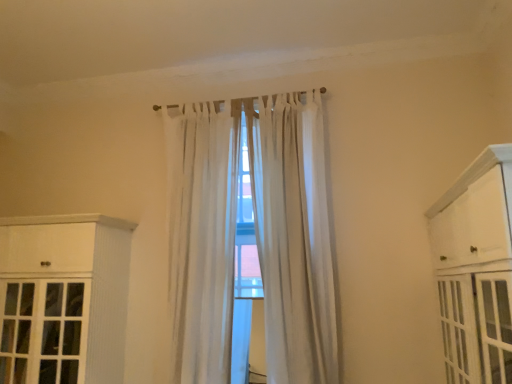
This screenshot has height=384, width=512. Describe the element at coordinates (256, 235) in the screenshot. I see `white sheer curtain at center, placed as the second curtain when sorted from left to right` at that location.

Find the location of a particular element. This screenshot has height=384, width=512. white wood cabinet at left, which is counted as the 2th cabinetry, starting from the front is located at coordinates (63, 298).

What do you see at coordinates (476, 270) in the screenshot? I see `white painted wood cabinet at right, which is the first cabinetry in front-to-back order` at bounding box center [476, 270].

This screenshot has height=384, width=512. Identify the location of white sheer curtain at center, placed as the second curtain when sorted from left to right. (256, 235).

Can you confirm if white sheer curtain at center, placed as the first curtain when sorted from right to left, is shorter than white painted wood cabinet at right, positioned as the second cabinetry in left-to-right order?

In fact, white sheer curtain at center, placed as the first curtain when sorted from right to left, may be taller than white painted wood cabinet at right, positioned as the second cabinetry in left-to-right order.

Choose the correct answer: Is white sheer curtain at center, placed as the second curtain when sorted from left to right, inside white painted wood cabinet at right, positioned as the second cabinetry in left-to-right order, or outside it?

white sheer curtain at center, placed as the second curtain when sorted from left to right, is not enclosed by white painted wood cabinet at right, positioned as the second cabinetry in left-to-right order.

Consider the image. Is white sheer curtain at center, placed as the first curtain when sorted from right to left, turned away from white painted wood cabinet at right, positioned as the second cabinetry in left-to-right order?

No, white sheer curtain at center, placed as the first curtain when sorted from right to left,'s orientation is not away from white painted wood cabinet at right, positioned as the second cabinetry in left-to-right order.

Does point (443, 275) come behind point (298, 360)?

No, it is in front of (298, 360).

Where is `the 2nd curtain above the white painted wood cabinet at right, positioned as the 1th cabinetry in right-to-left order (from the image's perspective)`? the 2nd curtain above the white painted wood cabinet at right, positioned as the 1th cabinetry in right-to-left order (from the image's perspective) is located at coordinates (256, 235).

How much distance is there between white painted wood cabinet at right, positioned as the 1th cabinetry in right-to-left order, and white sheer curtain at center, placed as the second curtain when sorted from left to right?

white painted wood cabinet at right, positioned as the 1th cabinetry in right-to-left order, is 1.26 meters away from white sheer curtain at center, placed as the second curtain when sorted from left to right.

Is white painted wood cabinet at right, arranged as the 2th cabinetry when viewed from the back, facing towards white sheer curtain at center, placed as the second curtain when sorted from left to right?

Yes, white painted wood cabinet at right, arranged as the 2th cabinetry when viewed from the back, is aimed at white sheer curtain at center, placed as the second curtain when sorted from left to right.

Are white sheer curtain at center, the 1th curtain when ordered from left to right, and white sheer curtain at center, placed as the second curtain when sorted from left to right, located far from each other?

→ No, white sheer curtain at center, the 1th curtain when ordered from left to right, is not far from white sheer curtain at center, placed as the second curtain when sorted from left to right.

Considering the points (203, 343) and (280, 100), which point is in front, point (203, 343) or point (280, 100)?

The point (203, 343) is more forward.

Is white sheer curtain at center, which ranks as the 2th curtain in right-to-left order, spatially inside white sheer curtain at center, placed as the second curtain when sorted from left to right, or outside of it?

white sheer curtain at center, which ranks as the 2th curtain in right-to-left order, cannot be found inside white sheer curtain at center, placed as the second curtain when sorted from left to right.

Do you think white sheer curtain at center, placed as the first curtain when sorted from right to left, is within white sheer curtain at center, the 1th curtain when ordered from left to right, or outside of it?

white sheer curtain at center, placed as the first curtain when sorted from right to left, exists outside the volume of white sheer curtain at center, the 1th curtain when ordered from left to right.

From the picture: Are white sheer curtain at center, placed as the first curtain when sorted from right to left, and white sheer curtain at center, the 1th curtain when ordered from left to right, far apart?

white sheer curtain at center, placed as the first curtain when sorted from right to left, is actually quite close to white sheer curtain at center, the 1th curtain when ordered from left to right.

How much distance is there between white sheer curtain at center, placed as the second curtain when sorted from left to right, and white sheer curtain at center, the 1th curtain when ordered from left to right?

white sheer curtain at center, placed as the second curtain when sorted from left to right, and white sheer curtain at center, the 1th curtain when ordered from left to right, are 7.47 inches apart from each other.

In the scene shown: Considering the sizes of objects white sheer curtain at center, placed as the second curtain when sorted from left to right, and white sheer curtain at center, the 1th curtain when ordered from left to right, in the image provided, who is shorter, white sheer curtain at center, placed as the second curtain when sorted from left to right, or white sheer curtain at center, the 1th curtain when ordered from left to right,?

With less height is white sheer curtain at center, the 1th curtain when ordered from left to right.

Is the depth of white sheer curtain at center, placed as the second curtain when sorted from left to right, less than that of white wood cabinet at left, which ranks as the first cabinetry in back-to-front order?

That is False.

Is white wood cabinet at left, the first cabinetry when ordered from left to right, located within white sheer curtain at center, placed as the first curtain when sorted from right to left?

Actually, white wood cabinet at left, the first cabinetry when ordered from left to right, is outside white sheer curtain at center, placed as the first curtain when sorted from right to left.

Is white sheer curtain at center, placed as the second curtain when sorted from left to right, aimed at white wood cabinet at left, which appears as the 2th cabinetry when viewed from the right?

No.

Is white wood cabinet at left, the first cabinetry when ordered from left to right, further to camera compared to white painted wood cabinet at right, which is the first cabinetry in front-to-back order?

Yes, white wood cabinet at left, the first cabinetry when ordered from left to right, is behind white painted wood cabinet at right, which is the first cabinetry in front-to-back order.

Which of these two, white wood cabinet at left, the first cabinetry when ordered from left to right, or white painted wood cabinet at right, positioned as the 1th cabinetry in right-to-left order, is wider?

white wood cabinet at left, the first cabinetry when ordered from left to right, is wider.

I want to click on cabinetry below the white painted wood cabinet at right, positioned as the second cabinetry in left-to-right order (from the image's perspective), so click(x=63, y=298).

From a real-world perspective, is white wood cabinet at left, which is counted as the 2th cabinetry, starting from the front, physically located above or below white painted wood cabinet at right, positioned as the 1th cabinetry in right-to-left order?

In terms of real-world spatial position, white wood cabinet at left, which is counted as the 2th cabinetry, starting from the front, is below white painted wood cabinet at right, positioned as the 1th cabinetry in right-to-left order.

From a real-world perspective, relative to white sheer curtain at center, placed as the first curtain when sorted from right to left, is white wood cabinet at left, which ranks as the first cabinetry in back-to-front order, vertically above or below?

white wood cabinet at left, which ranks as the first cabinetry in back-to-front order, is below white sheer curtain at center, placed as the first curtain when sorted from right to left.

What's the angular difference between white wood cabinet at left, which ranks as the first cabinetry in back-to-front order, and white sheer curtain at center, placed as the second curtain when sorted from left to right,'s facing directions?

There is a 0.000211-degree angle between the facing directions of white wood cabinet at left, which ranks as the first cabinetry in back-to-front order, and white sheer curtain at center, placed as the second curtain when sorted from left to right.

Can you confirm if white wood cabinet at left, which appears as the 2th cabinetry when viewed from the right, is positioned to the left of white sheer curtain at center, placed as the second curtain when sorted from left to right?

Yes.

Considering the sizes of objects white wood cabinet at left, which appears as the 2th cabinetry when viewed from the right, and white sheer curtain at center, placed as the first curtain when sorted from right to left, in the image provided, who is smaller, white wood cabinet at left, which appears as the 2th cabinetry when viewed from the right, or white sheer curtain at center, placed as the first curtain when sorted from right to left,?

white sheer curtain at center, placed as the first curtain when sorted from right to left.

Where is `curtain that is the 2nd object above the white painted wood cabinet at right, positioned as the second cabinetry in left-to-right order (from a real-world perspective)`? This screenshot has height=384, width=512. curtain that is the 2nd object above the white painted wood cabinet at right, positioned as the second cabinetry in left-to-right order (from a real-world perspective) is located at coordinates (256, 235).

Image resolution: width=512 pixels, height=384 pixels. I want to click on cabinetry that is the 1st one below the white sheer curtain at center, placed as the first curtain when sorted from right to left (from a real-world perspective), so click(476, 270).

From the image, which object appears to be farther from white sheer curtain at center, placed as the first curtain when sorted from right to left, white painted wood cabinet at right, which is the first cabinetry in front-to-back order, or white sheer curtain at center, which ranks as the 2th curtain in right-to-left order?

white painted wood cabinet at right, which is the first cabinetry in front-to-back order, is further to white sheer curtain at center, placed as the first curtain when sorted from right to left.

Based on the photo, looking at the image, which one is located closer to white sheer curtain at center, which ranks as the 2th curtain in right-to-left order, white sheer curtain at center, placed as the second curtain when sorted from left to right, or white wood cabinet at left, which is counted as the 2th cabinetry, starting from the front?

white sheer curtain at center, placed as the second curtain when sorted from left to right.

Considering their positions, is white sheer curtain at center, placed as the second curtain when sorted from left to right, positioned further to white painted wood cabinet at right, which is the first cabinetry in front-to-back order, than white sheer curtain at center, which ranks as the 2th curtain in right-to-left order?

white sheer curtain at center, which ranks as the 2th curtain in right-to-left order, is positioned further to the anchor white painted wood cabinet at right, which is the first cabinetry in front-to-back order.

Estimate the real-world distances between objects in this image. Which object is closer to white wood cabinet at left, which appears as the 2th cabinetry when viewed from the right, white sheer curtain at center, which ranks as the 2th curtain in right-to-left order, or white painted wood cabinet at right, arranged as the 2th cabinetry when viewed from the back?

The object closer to white wood cabinet at left, which appears as the 2th cabinetry when viewed from the right, is white sheer curtain at center, which ranks as the 2th curtain in right-to-left order.

Estimate the real-world distances between objects in this image. Which object is further from white sheer curtain at center, which ranks as the 2th curtain in right-to-left order, white wood cabinet at left, which appears as the 2th cabinetry when viewed from the right, or white sheer curtain at center, placed as the first curtain when sorted from right to left?

white wood cabinet at left, which appears as the 2th cabinetry when viewed from the right, is positioned further to the anchor white sheer curtain at center, which ranks as the 2th curtain in right-to-left order.

Considering their positions, is white sheer curtain at center, placed as the second curtain when sorted from left to right, positioned further to white painted wood cabinet at right, positioned as the 1th cabinetry in right-to-left order, than white wood cabinet at left, which ranks as the first cabinetry in back-to-front order?

white wood cabinet at left, which ranks as the first cabinetry in back-to-front order.

Based on their spatial positions, is white painted wood cabinet at right, arranged as the 2th cabinetry when viewed from the back, or white sheer curtain at center, placed as the first curtain when sorted from right to left, closer to white wood cabinet at left, the first cabinetry when ordered from left to right?

white sheer curtain at center, placed as the first curtain when sorted from right to left.

Which object lies nearer to the anchor point white sheer curtain at center, placed as the first curtain when sorted from right to left, white sheer curtain at center, which ranks as the 2th curtain in right-to-left order, or white painted wood cabinet at right, positioned as the 1th cabinetry in right-to-left order?

The object closer to white sheer curtain at center, placed as the first curtain when sorted from right to left, is white sheer curtain at center, which ranks as the 2th curtain in right-to-left order.

In order to click on curtain situated between white wood cabinet at left, which appears as the 2th cabinetry when viewed from the right, and white sheer curtain at center, placed as the first curtain when sorted from right to left, from left to right in this screenshot , I will do `click(202, 237)`.

You are a GUI agent. You are given a task and a screenshot of the screen. Output one action in this format:
    pyautogui.click(x=<x>, y=<y>)
    Task: Click on the curtain located between white painted wood cabinet at right, which is the first cabinetry in front-to-back order, and white sheer curtain at center, placed as the first curtain when sorted from right to left, in the depth direction
    The height and width of the screenshot is (384, 512).
    Given the screenshot: What is the action you would take?
    pyautogui.click(x=202, y=237)